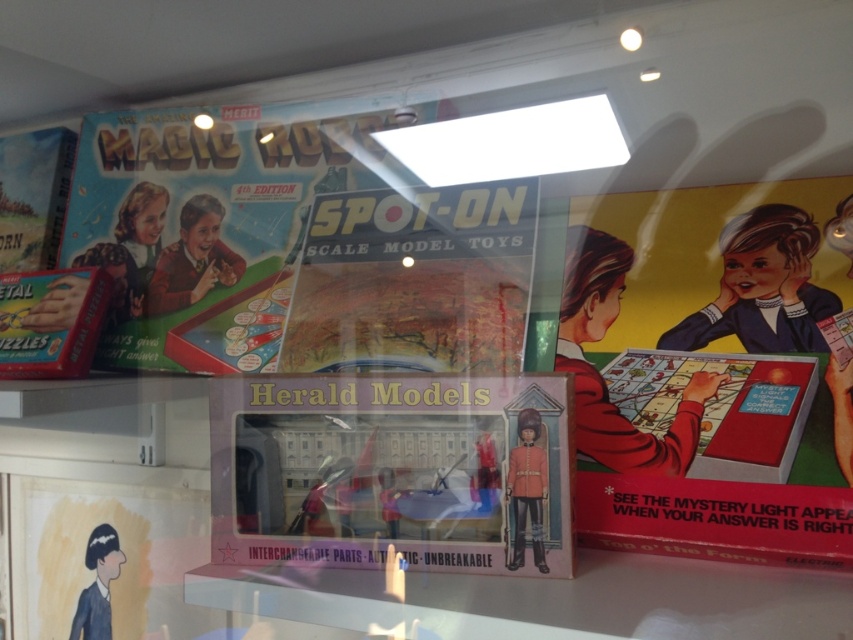
You are a child looking at a display of vintage toys. You see a matte cardboard comic book at center and a matte black toy soldier at lower left. Which object is closer to your right side?

The matte cardboard comic book at center is positioned on the right side of the matte black toy soldier at lower left, so it is closer to your right side.

You are a museum visitor who wants to take a photo of both the matte cardboard game at upper left and the matte cardboard comic book at center. However, your camera can only focus on objects within a 10 cm width range. Can you fit both items into the frame without moving the camera?

The matte cardboard game at upper left might be wider than the matte cardboard comic book at center, so the width difference could exceed the 10 cm focus range. Therefore, it might not be possible to capture both without adjusting the camera position.